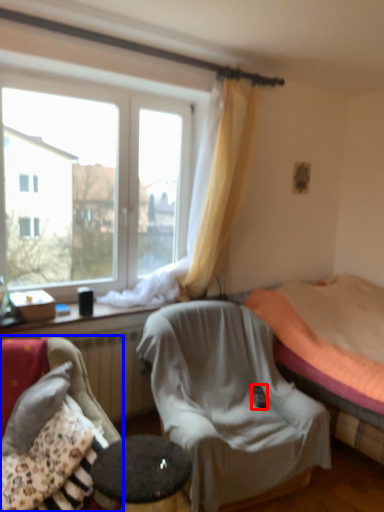
Question: Which object appears farthest to the camera in this image, remote control (highlighted by a red box) or chair (highlighted by a blue box)?

Choices:
 (A) remote control
 (B) chair

Answer: (A)